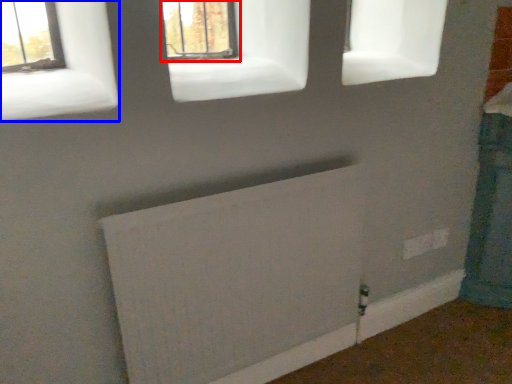
Question: Which point is closer to the camera, window (highlighted by a red box) or window (highlighted by a blue box)?

Choices:
 (A) window
 (B) window

Answer: (B)